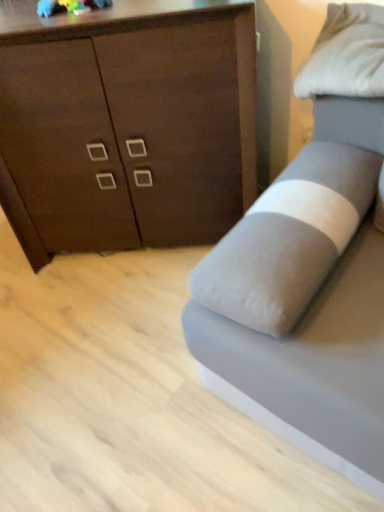
Question: From a real-world perspective, is dark wood cabinet at upper left on top of gray fabric studio couch at right?

Choices:
 (A) no
 (B) yes

Answer: (B)

Question: Is dark wood cabinet at upper left far from gray fabric studio couch at right?

Choices:
 (A) yes
 (B) no

Answer: (B)

Question: Does dark wood cabinet at upper left have a smaller size compared to gray fabric studio couch at right?

Choices:
 (A) no
 (B) yes

Answer: (B)

Question: From a real-world perspective, is dark wood cabinet at upper left under gray fabric studio couch at right?

Choices:
 (A) no
 (B) yes

Answer: (A)

Question: Is dark wood cabinet at upper left turned away from gray fabric studio couch at right?

Choices:
 (A) yes
 (B) no

Answer: (B)

Question: Does point (246, 187) appear closer or farther from the camera than point (274, 420)?

Choices:
 (A) farther
 (B) closer

Answer: (A)

Question: Considering the relative positions of dark wood cabinet at upper left and gray fabric studio couch at right in the image provided, is dark wood cabinet at upper left to the left or to the right of gray fabric studio couch at right?

Choices:
 (A) left
 (B) right

Answer: (A)

Question: From the image's perspective, is dark wood cabinet at upper left positioned above or below gray fabric studio couch at right?

Choices:
 (A) below
 (B) above

Answer: (B)

Question: In terms of height, does dark wood cabinet at upper left look taller or shorter compared to gray fabric studio couch at right?

Choices:
 (A) tall
 (B) short

Answer: (A)

Question: Is point (311, 66) positioned closer to the camera than point (144, 182)?

Choices:
 (A) farther
 (B) closer

Answer: (B)

Question: Based on their sizes in the image, would you say white soft pillow at upper right is bigger or smaller than dark wood cabinet at upper left?

Choices:
 (A) big
 (B) small

Answer: (B)

Question: Which is correct: white soft pillow at upper right is inside dark wood cabinet at upper left, or outside of it?

Choices:
 (A) outside
 (B) inside

Answer: (A)

Question: From the image's perspective, is white soft pillow at upper right positioned above or below dark wood cabinet at upper left?

Choices:
 (A) below
 (B) above

Answer: (B)

Question: Is point (192, 353) closer or farther from the camera than point (198, 69)?

Choices:
 (A) farther
 (B) closer

Answer: (B)

Question: Is gray fabric studio couch at right wider or thinner than dark wood cabinet at upper left?

Choices:
 (A) wide
 (B) thin

Answer: (A)